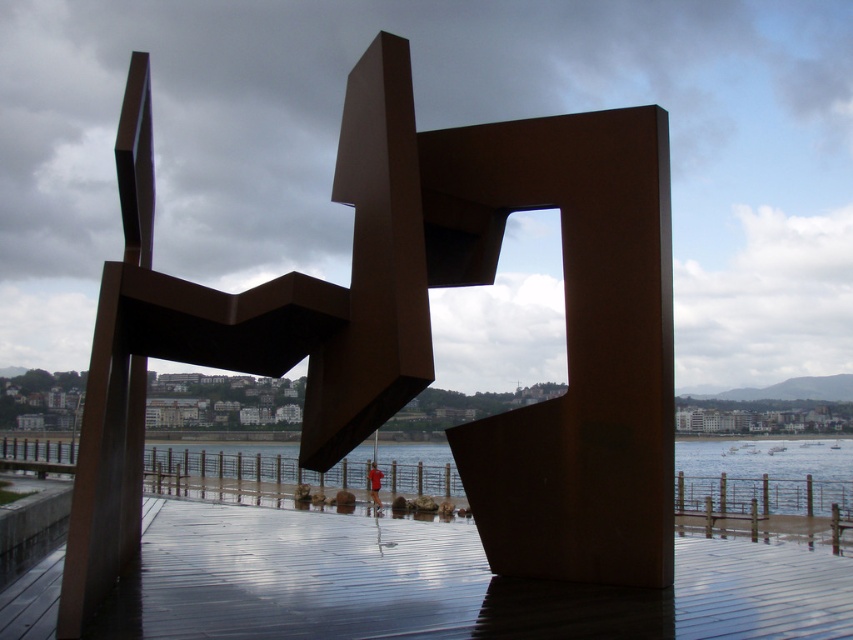
Question: Which object is the closest to the rusty metal sculpture at center?

Choices:
 (A) clear water at lower center
 (B) shiny wooden dock at center

Answer: (B)

Question: Considering the real-world distances, which object is closest to the clear water at lower center?

Choices:
 (A) shiny wooden dock at center
 (B) rusty metal sculpture at center

Answer: (A)

Question: Which of the following is the closest to the observer?

Choices:
 (A) (247, 529)
 (B) (151, 218)
 (C) (144, 467)

Answer: (B)

Question: Is rusty metal sculpture at center closer to camera compared to clear water at lower center?

Choices:
 (A) yes
 (B) no

Answer: (A)

Question: Can you confirm if rusty metal sculpture at center is positioned to the right of clear water at lower center?

Choices:
 (A) yes
 (B) no

Answer: (B)

Question: Is shiny wooden dock at center to the right of clear water at lower center from the viewer's perspective?

Choices:
 (A) yes
 (B) no

Answer: (A)